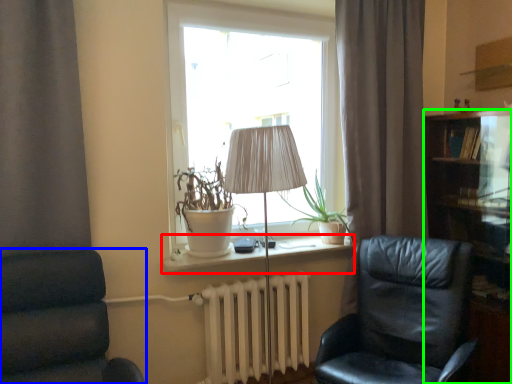
Question: Which is farther away from window sill (highlighted by a red box)? chair (highlighted by a blue box) or cabinetry (highlighted by a green box)?

Choices:
 (A) chair
 (B) cabinetry

Answer: (B)